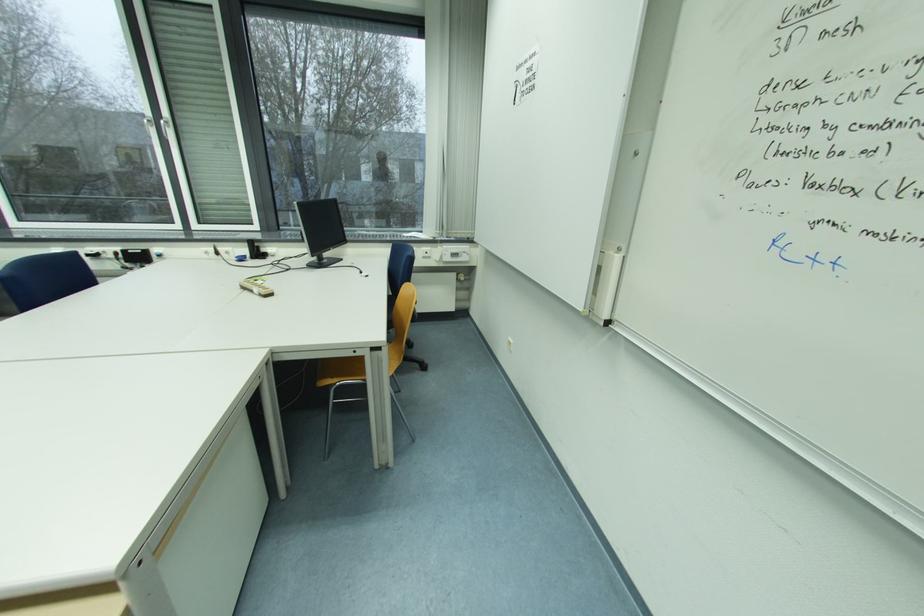
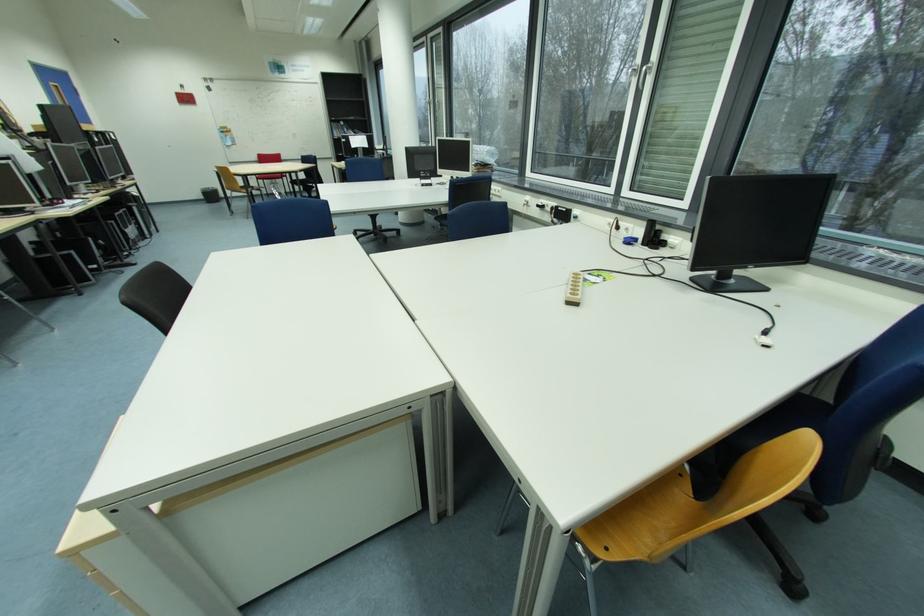
From the picture: How did the camera likely rotate?

The camera rotated toward left-down.